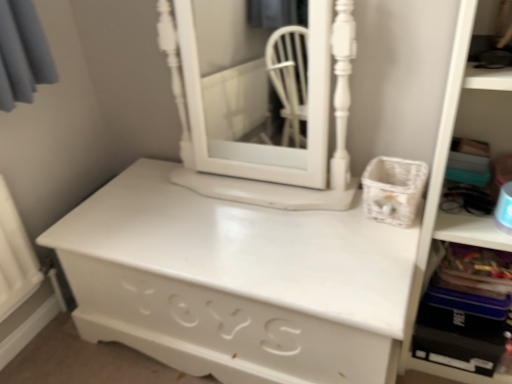
Question: Is white matte chest of drawers at center not within white plastic bookshelf at right?

Choices:
 (A) no
 (B) yes

Answer: (B)

Question: Does white matte chest of drawers at center have a lesser height compared to white plastic bookshelf at right?

Choices:
 (A) no
 (B) yes

Answer: (B)

Question: Does white matte chest of drawers at center appear on the left side of white plastic bookshelf at right?

Choices:
 (A) no
 (B) yes

Answer: (B)

Question: Does white matte chest of drawers at center have a larger size compared to white plastic bookshelf at right?

Choices:
 (A) no
 (B) yes

Answer: (B)

Question: Is white plastic bookshelf at right surrounded by white matte chest of drawers at center?

Choices:
 (A) yes
 (B) no

Answer: (B)

Question: Is white matte chest of drawers at center bigger or smaller than white painted wood medicine cabinet at center?

Choices:
 (A) big
 (B) small

Answer: (A)

Question: From a real-world perspective, is white matte chest of drawers at center physically located above or below white painted wood medicine cabinet at center?

Choices:
 (A) above
 (B) below

Answer: (B)

Question: In the image, is white matte chest of drawers at center positioned in front of or behind white painted wood medicine cabinet at center?

Choices:
 (A) behind
 (B) front

Answer: (B)

Question: Is point (374, 261) closer or farther from the camera than point (209, 165)?

Choices:
 (A) farther
 (B) closer

Answer: (B)

Question: Would you say white painted wood medicine cabinet at center is inside or outside white plastic bookshelf at right?

Choices:
 (A) outside
 (B) inside

Answer: (A)

Question: Visually, is white painted wood medicine cabinet at center positioned to the left or to the right of white plastic bookshelf at right?

Choices:
 (A) right
 (B) left

Answer: (B)

Question: Is white painted wood medicine cabinet at center taller or shorter than white plastic bookshelf at right?

Choices:
 (A) short
 (B) tall

Answer: (A)

Question: Relative to white plastic bookshelf at right, is white painted wood medicine cabinet at center in front or behind?

Choices:
 (A) front
 (B) behind

Answer: (B)

Question: From a real-world perspective, is white plastic bookshelf at right positioned above or below white painted wood medicine cabinet at center?

Choices:
 (A) below
 (B) above

Answer: (A)

Question: Relative to white painted wood medicine cabinet at center, is white plastic bookshelf at right in front or behind?

Choices:
 (A) front
 (B) behind

Answer: (A)